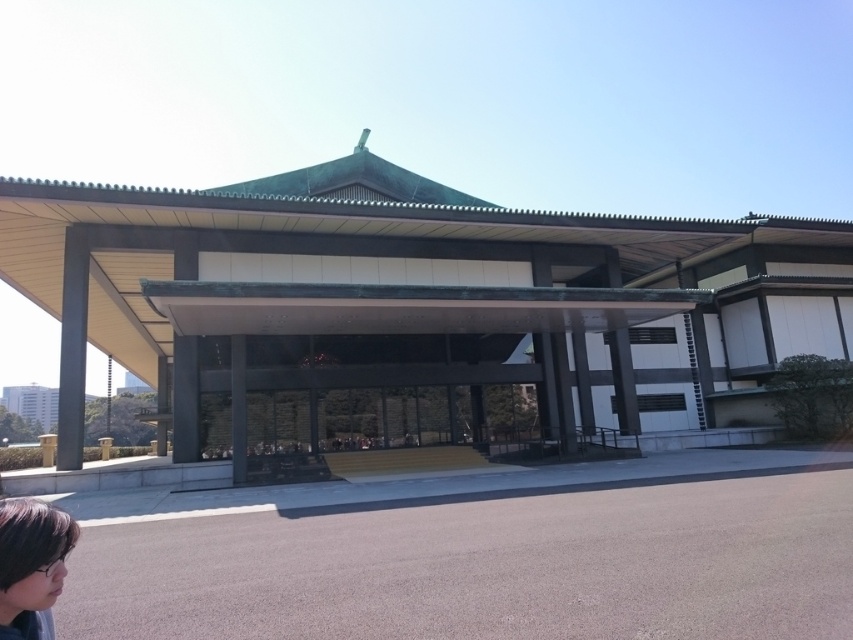
Between green matte building at center and dark brown hair at lower left, which one is positioned higher?

green matte building at center is above.

Is point (10, 211) positioned before point (0, 630)?

No, it is not.

This screenshot has width=853, height=640. What are the coordinates of `green matte building at center` in the screenshot? It's located at (409, 307).